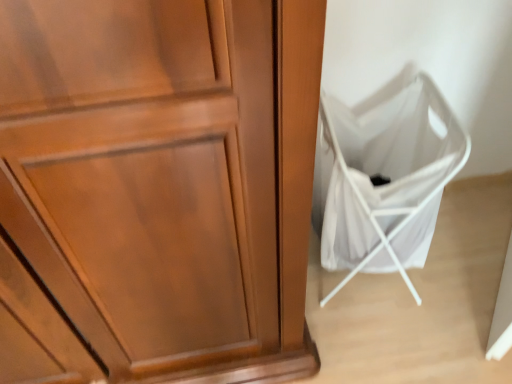
You are a GUI agent. You are given a task and a screenshot of the screen. Output one action in this format:
    pyautogui.click(x=<x>, y=<y>)
    Task: Click on the vacant location below white fabric baby carriage at right (from a real-world perspective)
    This screenshot has height=384, width=512.
    Given the screenshot: What is the action you would take?
    pyautogui.click(x=364, y=290)